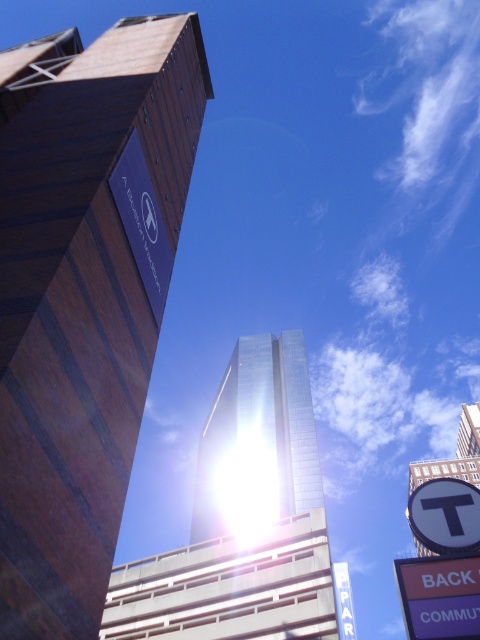
You are a drone operator tasked with delivering a package from the glossy glass tower at center to the white plastic sign at lower right. The drone has a maximum range of 100 meters. Can the drone complete the delivery without needing a recharge?

The glossy glass tower at center is 110.42 meters from the white plastic sign at lower right. Since the drone has a maximum range of 100 meters, it cannot complete the delivery without needing a recharge.

You are a city planner analyzing the urban layout. Considering the glossy glass tower at center and the purple plastic sign at lower right, which object would cast a larger shadow during midday when the sun is directly overhead?

The glossy glass tower at center has a larger size compared to the purple plastic sign at lower right, so it would cast a larger shadow during midday when the sun is directly overhead.